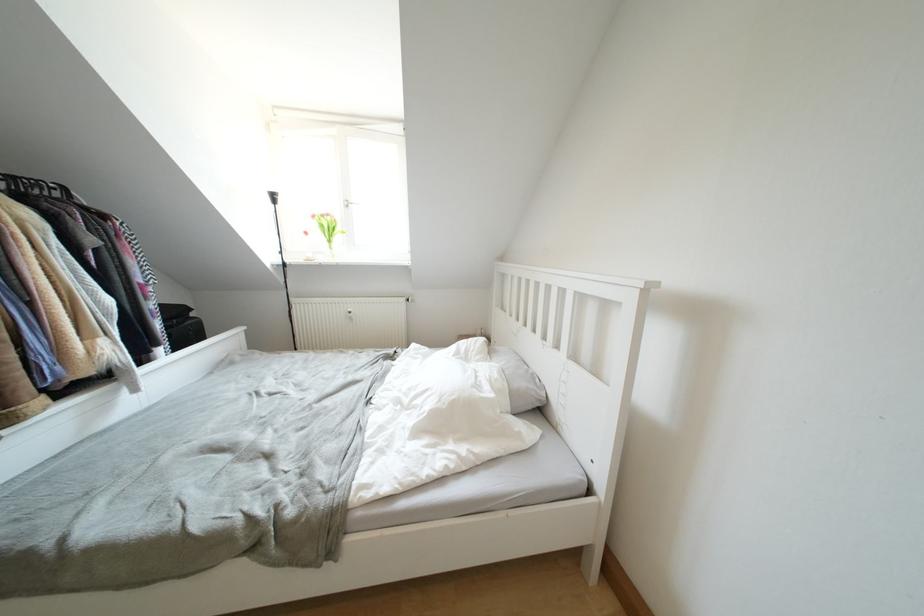
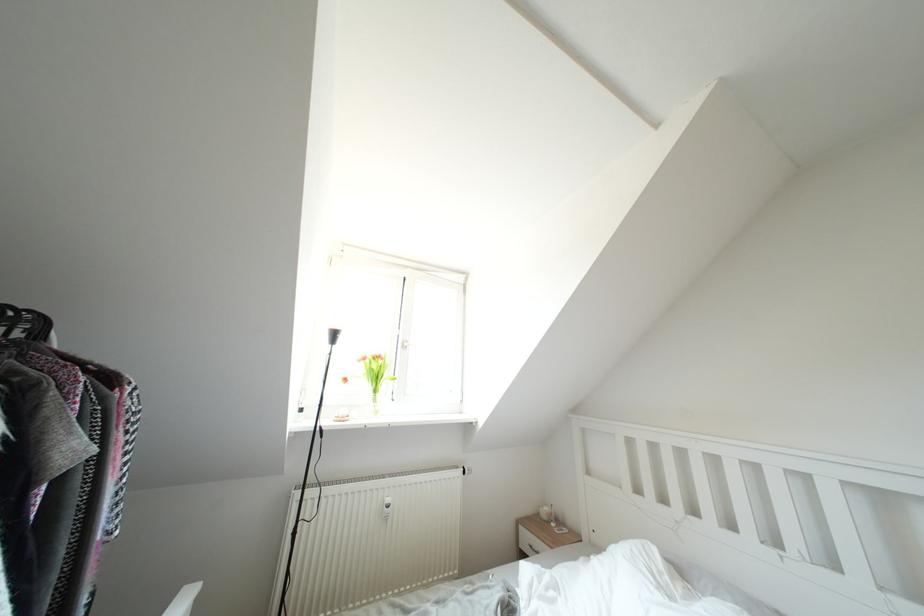
Find the pixel in the second image that matches the point at 319,220 in the first image.

(370, 363)